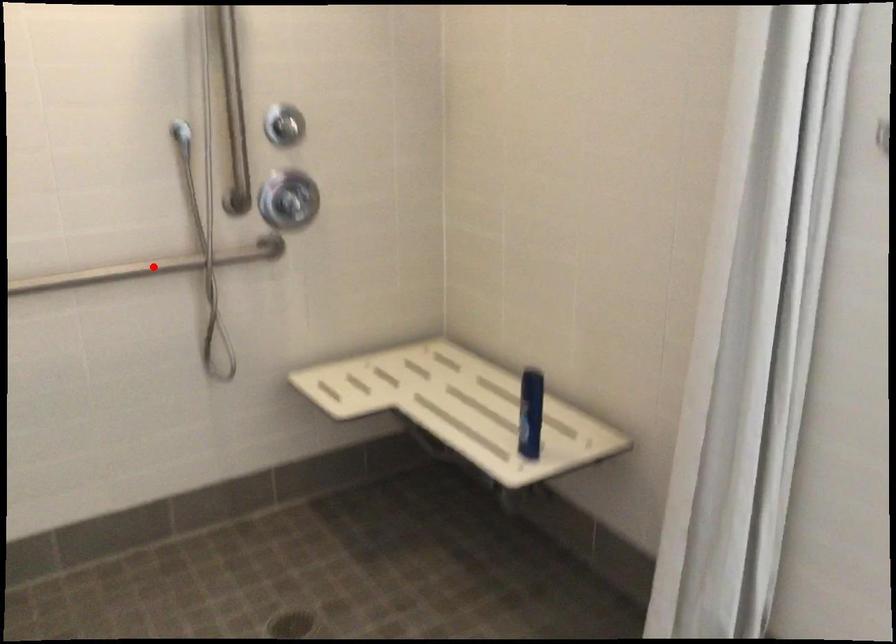
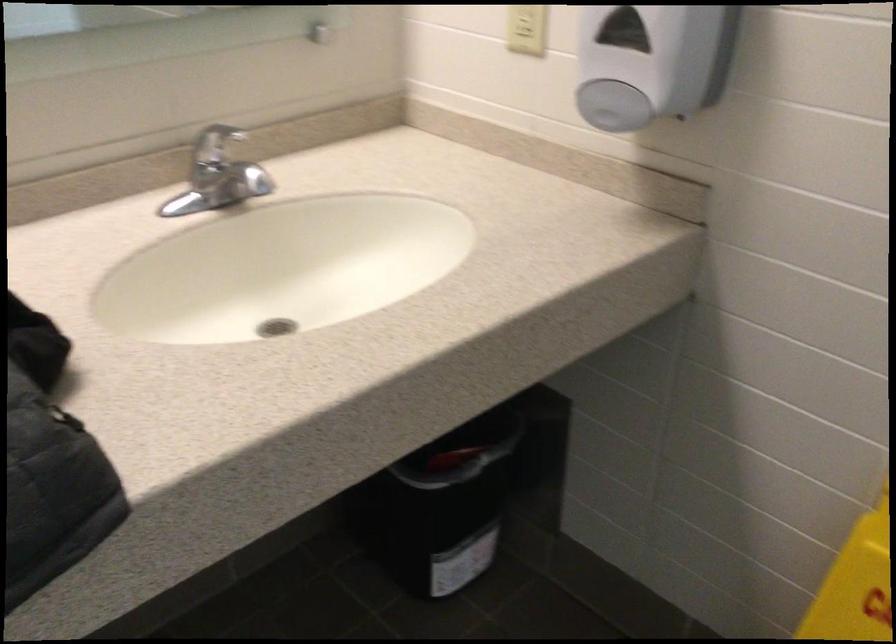
Question: I am providing you with two images of the same scene from different viewpoints. A red point is marked on the first image. Can you still see the location of the red point in image 2?

Choices:
 (A) Yes
 (B) No

Answer: (B)